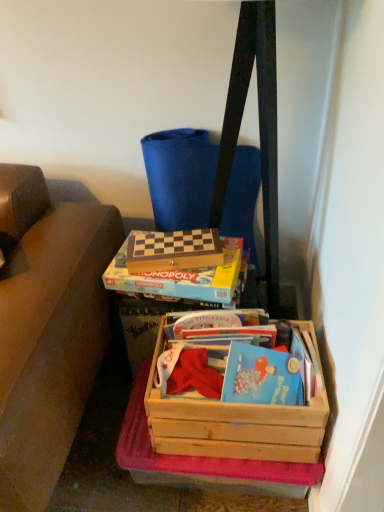
Question: Considering the relative sizes of wooden chessboard at center, positioned as the 3th box in bottom-to-top order, and wooden crate at lower right, positioned as the first box in bottom-to-top order, in the image provided, is wooden chessboard at center, positioned as the 3th box in bottom-to-top order, wider than wooden crate at lower right, positioned as the first box in bottom-to-top order,?

Choices:
 (A) no
 (B) yes

Answer: (A)

Question: Does wooden chessboard at center, which is the first box from top to bottom, turn towards wooden crate at lower right, positioned as the first box in bottom-to-top order?

Choices:
 (A) no
 (B) yes

Answer: (A)

Question: Does wooden chessboard at center, positioned as the 3th box in bottom-to-top order, have a lesser width compared to wooden crate at lower right, which is the third box from top to bottom?

Choices:
 (A) no
 (B) yes

Answer: (B)

Question: Is wooden chessboard at center, which is the first box from top to bottom, looking in the opposite direction of wooden crate at lower right, positioned as the first box in bottom-to-top order?

Choices:
 (A) no
 (B) yes

Answer: (A)

Question: Is wooden chessboard at center, positioned as the 3th box in bottom-to-top order, shorter than wooden crate at lower right, which is the third box from top to bottom?

Choices:
 (A) no
 (B) yes

Answer: (B)

Question: From their relative heights in the image, would you say wooden crate at lower right, positioned as the first box in bottom-to-top order, is taller or shorter than wooden messenger bag at upper center?

Choices:
 (A) tall
 (B) short

Answer: (B)

Question: Would you say wooden crate at lower right, positioned as the first box in bottom-to-top order, is inside or outside wooden messenger bag at upper center?

Choices:
 (A) inside
 (B) outside

Answer: (B)

Question: From the image's perspective, is wooden crate at lower right, positioned as the first box in bottom-to-top order, located above or below wooden messenger bag at upper center?

Choices:
 (A) above
 (B) below

Answer: (B)

Question: Considering the positions of wooden crate at lower right, which is the third box from top to bottom, and wooden messenger bag at upper center in the image, is wooden crate at lower right, which is the third box from top to bottom, wider or thinner than wooden messenger bag at upper center?

Choices:
 (A) thin
 (B) wide

Answer: (B)

Question: From the image's perspective, relative to wooden monopoly game at center, which appears as the second box when viewed from the top, is wooden chessboard at center, positioned as the 3th box in bottom-to-top order, above or below?

Choices:
 (A) below
 (B) above

Answer: (B)

Question: Looking at their shapes, would you say wooden chessboard at center, positioned as the 3th box in bottom-to-top order, is wider or thinner than wooden monopoly game at center, the 2th box positioned from the bottom?

Choices:
 (A) thin
 (B) wide

Answer: (A)

Question: From their relative heights in the image, would you say wooden chessboard at center, which is the first box from top to bottom, is taller or shorter than wooden monopoly game at center, which appears as the second box when viewed from the top?

Choices:
 (A) short
 (B) tall

Answer: (A)

Question: Considering their positions, is wooden chessboard at center, which is the first box from top to bottom, located in front of or behind wooden monopoly game at center, the 2th box positioned from the bottom?

Choices:
 (A) front
 (B) behind

Answer: (B)

Question: Looking at the image, does wooden chessboard at center, positioned as the 3th box in bottom-to-top order, seem bigger or smaller compared to wooden crate at lower right, which is the third box from top to bottom?

Choices:
 (A) big
 (B) small

Answer: (B)

Question: From the image's perspective, relative to wooden crate at lower right, positioned as the first box in bottom-to-top order, is wooden chessboard at center, which is the first box from top to bottom, above or below?

Choices:
 (A) below
 (B) above

Answer: (B)